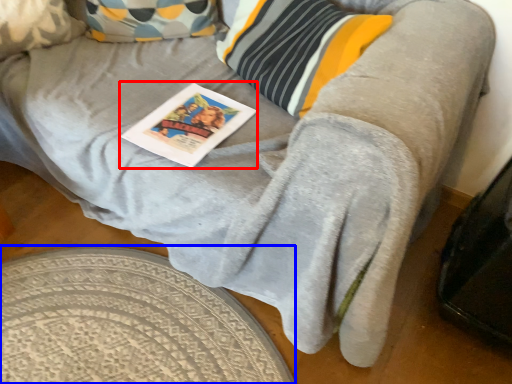
Question: Which object appears closest to the camera in this image, magazine (highlighted by a red box) or round table (highlighted by a blue box)?

Choices:
 (A) magazine
 (B) round table

Answer: (B)